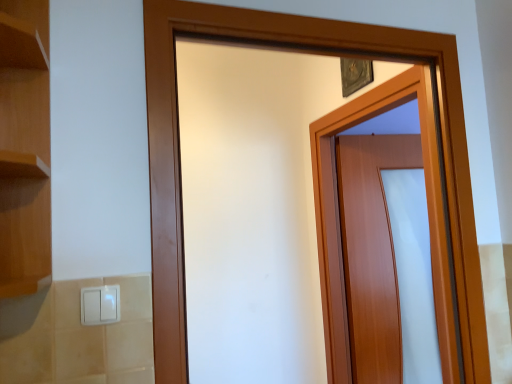
Question: Is wooden door at center, arranged as the 2th door when viewed from the front, located within white plastic light switch at lower left?

Choices:
 (A) no
 (B) yes

Answer: (A)

Question: From a real-world perspective, is white plastic light switch at lower left physically above wooden door at center, arranged as the 2th door when viewed from the front?

Choices:
 (A) no
 (B) yes

Answer: (B)

Question: Is white plastic light switch at lower left to the left of wooden door at center, which is counted as the 1th door, starting from the back, from the viewer's perspective?

Choices:
 (A) no
 (B) yes

Answer: (B)

Question: Does white plastic light switch at lower left appear on the right side of wooden door at center, arranged as the 2th door when viewed from the front?

Choices:
 (A) yes
 (B) no

Answer: (B)

Question: Does white plastic light switch at lower left have a greater width compared to wooden door at center, which is counted as the 1th door, starting from the back?

Choices:
 (A) yes
 (B) no

Answer: (B)

Question: Is wooden door at center, placed as the second door when sorted from back to front, taller or shorter than white plastic light switch at lower left?

Choices:
 (A) short
 (B) tall

Answer: (B)

Question: Considering the positions of wooden door at center, arranged as the 1th door when viewed from the front, and white plastic light switch at lower left in the image, is wooden door at center, arranged as the 1th door when viewed from the front, bigger or smaller than white plastic light switch at lower left?

Choices:
 (A) big
 (B) small

Answer: (A)

Question: Relative to white plastic light switch at lower left, is wooden door at center, placed as the second door when sorted from back to front, in front or behind?

Choices:
 (A) behind
 (B) front

Answer: (A)

Question: From the image's perspective, is wooden door at center, arranged as the 1th door when viewed from the front, above or below white plastic light switch at lower left?

Choices:
 (A) below
 (B) above

Answer: (B)

Question: Is wooden door at center, arranged as the 1th door when viewed from the front, in front of or behind wooden door at center, which is counted as the 1th door, starting from the back, in the image?

Choices:
 (A) front
 (B) behind

Answer: (A)

Question: From the image's perspective, is wooden door at center, placed as the second door when sorted from back to front, above or below wooden door at center, arranged as the 2th door when viewed from the front?

Choices:
 (A) below
 (B) above

Answer: (B)

Question: Would you say wooden door at center, arranged as the 1th door when viewed from the front, is inside or outside wooden door at center, arranged as the 2th door when viewed from the front?

Choices:
 (A) inside
 (B) outside

Answer: (B)

Question: Considering the positions of wooden door at center, arranged as the 1th door when viewed from the front, and wooden door at center, which is counted as the 1th door, starting from the back, in the image, is wooden door at center, arranged as the 1th door when viewed from the front, bigger or smaller than wooden door at center, which is counted as the 1th door, starting from the back,?

Choices:
 (A) small
 (B) big

Answer: (A)

Question: From their relative heights in the image, would you say white plastic light switch at lower left is taller or shorter than wooden door at center, which is counted as the 1th door, starting from the back?

Choices:
 (A) tall
 (B) short

Answer: (B)

Question: From a real-world perspective, relative to wooden door at center, arranged as the 2th door when viewed from the front, is white plastic light switch at lower left vertically above or below?

Choices:
 (A) below
 (B) above

Answer: (B)